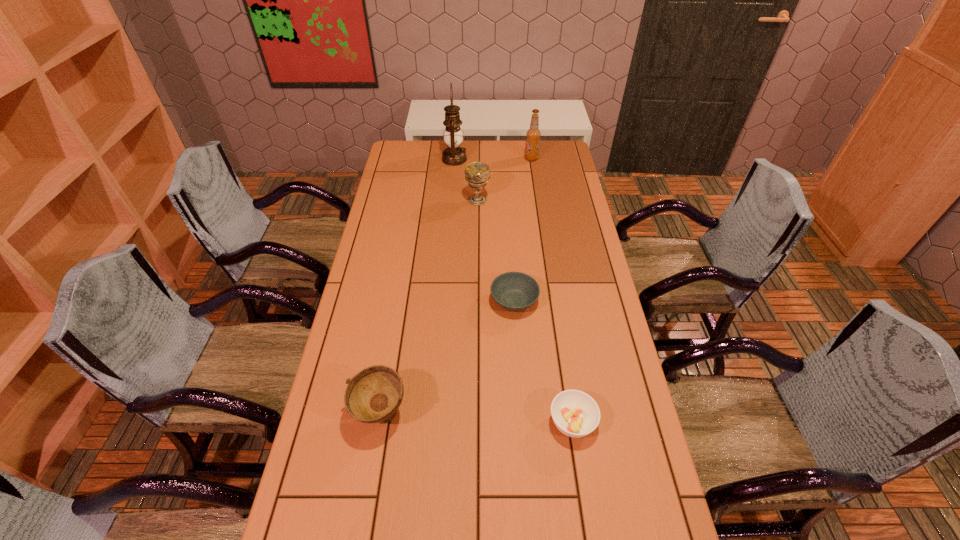
Where is `free space between the fifth shortest object and the leftmost soup bowl`? This screenshot has height=540, width=960. free space between the fifth shortest object and the leftmost soup bowl is located at coordinates (456, 286).

Where is `vacant space that is in between the beer bottle and the leftmost object`? vacant space that is in between the beer bottle and the leftmost object is located at coordinates click(456, 286).

The image size is (960, 540). I want to click on unoccupied area between the beer bottle and the tallest soup bowl, so click(456, 286).

Locate an element on the screen. The height and width of the screenshot is (540, 960). free space between the beer bottle and the tallest object is located at coordinates (492, 159).

The height and width of the screenshot is (540, 960). In order to click on free space that is in between the farthest soup bowl and the third farthest object in this screenshot , I will do `click(495, 251)`.

Identify the location of the fourth closest object relative to the beer bottle. Image resolution: width=960 pixels, height=540 pixels. (576, 414).

Locate which object ranks fifth in proximity to the third nearest object. Please provide its 2D coordinates. Your answer should be formatted as a tuple, i.e. [(x, y)], where the tuple contains the x and y coordinates of a point satisfying the conditions above.

[(533, 134)]

Locate which soup bowl ranks second in proximity to the chalice. Please provide its 2D coordinates. Your answer should be formatted as a tuple, i.e. [(x, y)], where the tuple contains the x and y coordinates of a point satisfying the conditions above.

[(374, 394)]

Where is `soup bowl that is the second closest to the fourth shortest object`? This screenshot has height=540, width=960. soup bowl that is the second closest to the fourth shortest object is located at coordinates (374, 394).